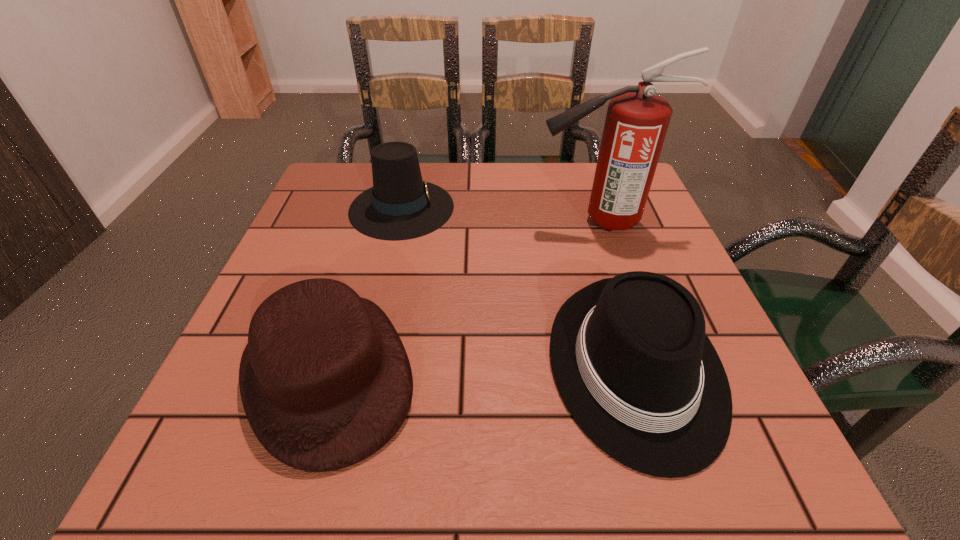
Image resolution: width=960 pixels, height=540 pixels. Find the location of `empty location between the farther hat and the tallest object`. empty location between the farther hat and the tallest object is located at coordinates (500, 214).

Where is `blank region between the fedora and the farther hat`? This screenshot has height=540, width=960. blank region between the fedora and the farther hat is located at coordinates (518, 287).

Choose which object is the third nearest neighbor to the fedora. Please provide its 2D coordinates. Your answer should be formatted as a tuple, i.e. [(x, y)], where the tuple contains the x and y coordinates of a point satisfying the conditions above.

[(400, 206)]

Locate an element on the screen. object that stands as the third closest to the shorter hat is located at coordinates (637, 120).

Identify the location of blank area in the image that satisfies the following two spatial constraints: 1. at the nozzle of the tallest object; 2. on the front-facing side of the fedora. The image size is (960, 540). (647, 367).